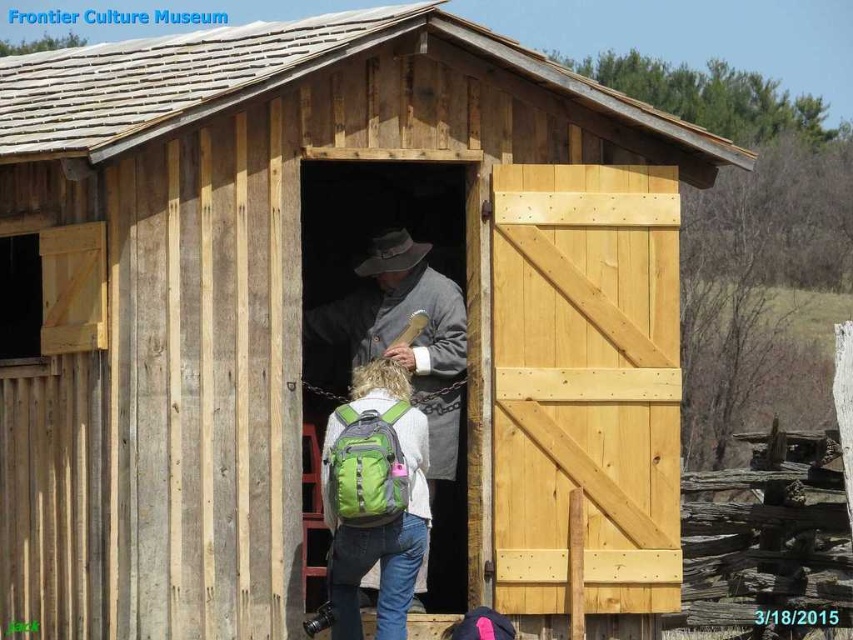
Can you confirm if natural wood barn door at right is taller than green fabric backpack at center?

Correct, natural wood barn door at right is much taller as green fabric backpack at center.

Who is positioned more to the left, natural wood barn door at right or green fabric backpack at center?

green fabric backpack at center

Which is in front, point (604, 420) or point (355, 538)?

Point (355, 538) is more forward.

Find the location of `natural wood barn door at right`. natural wood barn door at right is located at coordinates (585, 385).

Between natural wood barn door at right and gray woolen coat at center, which one is positioned higher?

gray woolen coat at center is higher up.

Is point (520, 228) behind point (370, 326)?

No, (520, 228) is in front of (370, 326).

Is point (605, 476) in front of point (323, 316)?

Yes.

Locate an element on the screen. The image size is (853, 640). natural wood barn door at right is located at coordinates (585, 385).

This screenshot has height=640, width=853. Describe the element at coordinates (404, 328) in the screenshot. I see `gray woolen coat at center` at that location.

Measure the distance between point (451, 422) and camera.

11.58 meters

The image size is (853, 640). In order to click on gray woolen coat at center in this screenshot , I will do `click(404, 328)`.